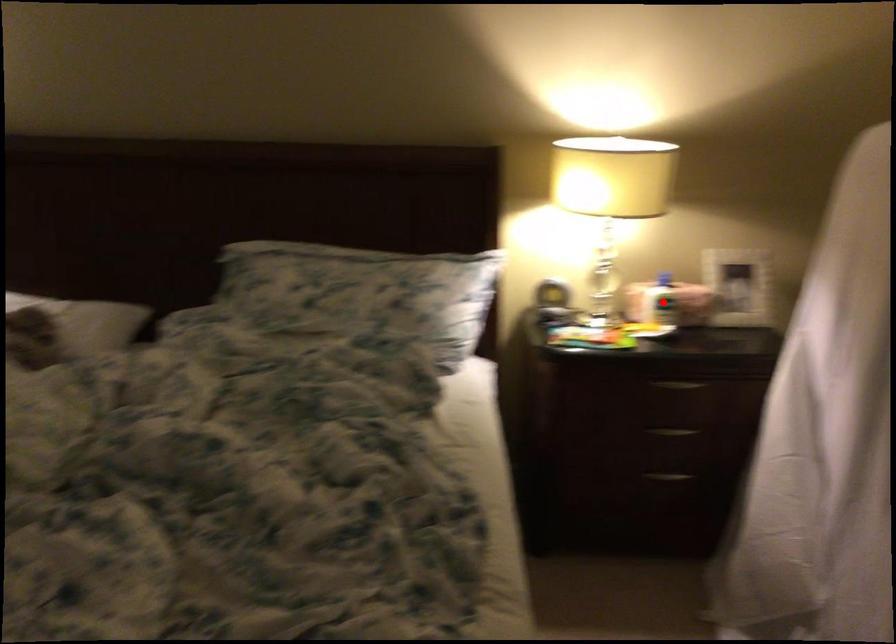
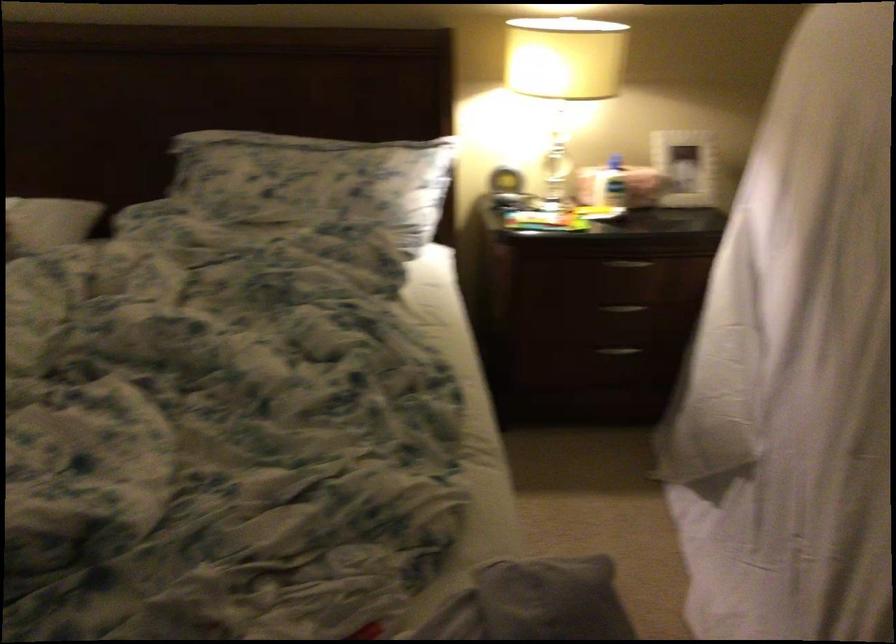
Find the pixel in the second image that matches the highlighted location in the first image.

(609, 184)